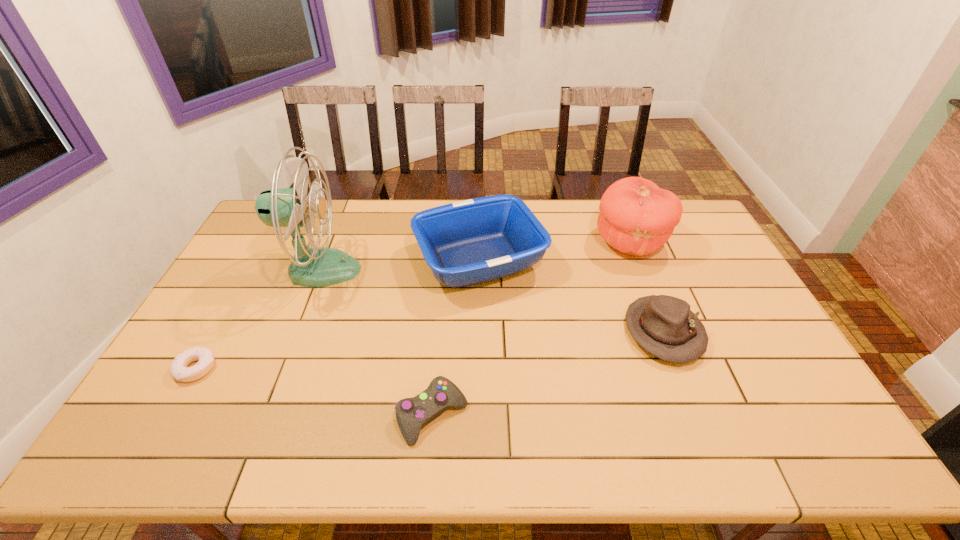
This screenshot has width=960, height=540. In the image, there is a desktop. Find the location of `blank space at the right edge`. blank space at the right edge is located at coordinates (752, 360).

At what (x,y) coordinates should I click in order to perform the action: click on free space between the hat and the fourth shortest object. Please return your answer as a coordinate pair (x, y). This screenshot has width=960, height=540. Looking at the image, I should click on (571, 296).

The height and width of the screenshot is (540, 960). I want to click on unoccupied area between the pumpkin and the leftmost object, so click(x=413, y=305).

Locate an element on the screen. This screenshot has width=960, height=540. vacant area that lies between the fourth shortest object and the pumpkin is located at coordinates (555, 251).

This screenshot has height=540, width=960. I want to click on free space between the shortest object and the pumpkin, so click(413, 305).

This screenshot has width=960, height=540. In order to click on free area in between the fifth tallest object and the doughnut in this screenshot , I will do `click(314, 392)`.

Locate an element on the screen. The height and width of the screenshot is (540, 960). free space between the fifth tallest object and the fan is located at coordinates (376, 342).

The width and height of the screenshot is (960, 540). Identify the location of free space between the nearest object and the doughnut. (314, 392).

I want to click on vacant space that's between the fifth shortest object and the hat, so click(x=646, y=287).

This screenshot has height=540, width=960. I want to click on free space between the doughnut and the fourth shortest object, so click(338, 314).